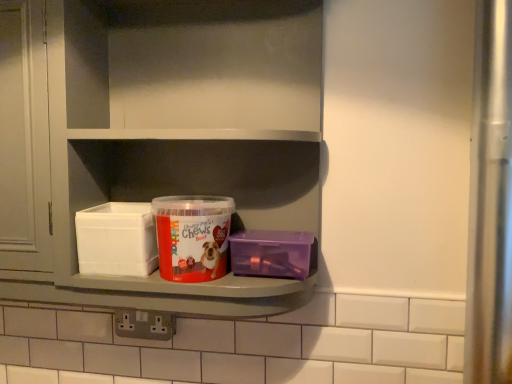
Question: Considering the relative positions of purple plastic container at right and red matte plastic container at center in the image provided, is purple plastic container at right to the left of red matte plastic container at center from the viewer's perspective?

Choices:
 (A) yes
 (B) no

Answer: (B)

Question: From the image's perspective, would you say purple plastic container at right is positioned over red matte plastic container at center?

Choices:
 (A) no
 (B) yes

Answer: (A)

Question: From a real-world perspective, is purple plastic container at right beneath red matte plastic container at center?

Choices:
 (A) yes
 (B) no

Answer: (A)

Question: Is purple plastic container at right surrounding red matte plastic container at center?

Choices:
 (A) no
 (B) yes

Answer: (A)

Question: Does purple plastic container at right come in front of red matte plastic container at center?

Choices:
 (A) no
 (B) yes

Answer: (A)

Question: Which is correct: white plastic shelf at center is inside purple plastic container at right, or outside of it?

Choices:
 (A) outside
 (B) inside

Answer: (A)

Question: From their relative heights in the image, would you say white plastic shelf at center is taller or shorter than purple plastic container at right?

Choices:
 (A) short
 (B) tall

Answer: (B)

Question: Considering their positions, is white plastic shelf at center located in front of or behind purple plastic container at right?

Choices:
 (A) front
 (B) behind

Answer: (A)

Question: Based on their positions, is white plastic shelf at center located to the left or right of purple plastic container at right?

Choices:
 (A) right
 (B) left

Answer: (B)

Question: Which is correct: purple plastic container at right is inside white plastic shelf at center, or outside of it?

Choices:
 (A) outside
 (B) inside

Answer: (B)

Question: From a real-world perspective, is purple plastic container at right positioned above or below white plastic shelf at center?

Choices:
 (A) above
 (B) below

Answer: (B)

Question: Is purple plastic container at right bigger or smaller than white plastic shelf at center?

Choices:
 (A) small
 (B) big

Answer: (A)

Question: Is point (251, 246) positioned closer to the camera than point (237, 147)?

Choices:
 (A) closer
 (B) farther

Answer: (A)

Question: From the image's perspective, relative to purple plastic container at right, is red matte plastic container at center above or below?

Choices:
 (A) above
 (B) below

Answer: (A)

Question: In terms of size, does red matte plastic container at center appear bigger or smaller than purple plastic container at right?

Choices:
 (A) big
 (B) small

Answer: (A)